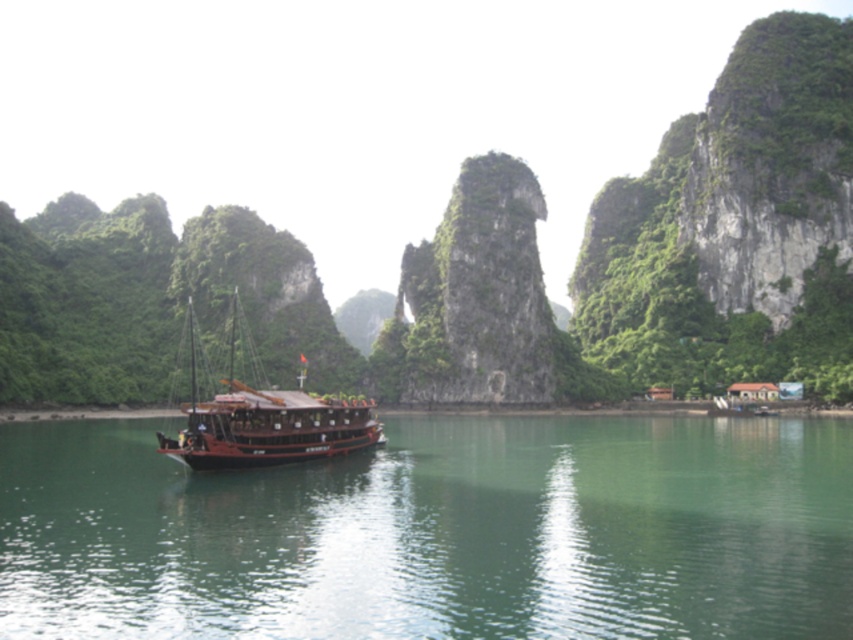
You are standing on the deck of the boat and looking at two points marked in the scene. The first point is at coordinate point [33,435] and the second is at point [273,420]. Which point is closer to you?

Point [33,435] is closer to you because it is further to the viewer than point [273,420].

You are a sailor on the wooden ship at center and want to know if the green smooth water at center is big enough to accommodate a larger boat. Can you determine this based on the scene?

The green smooth water at center has a smaller size compared to wooden ship at center, so it might not be sufficient to accommodate a larger boat.

You are standing on the deck of the boat and want to reach the point marked at coordinates point (508, 515). Given that the boat is moving away from you at a speed of 2 meters per second, how long will it take you to reach that point if you start moving towards it immediately?

The point marked at coordinates point (508, 515) is 60.06 meters away from the viewer. Since the boat is moving away at 2 meters per second, it will take 30.03 seconds to reach the point.